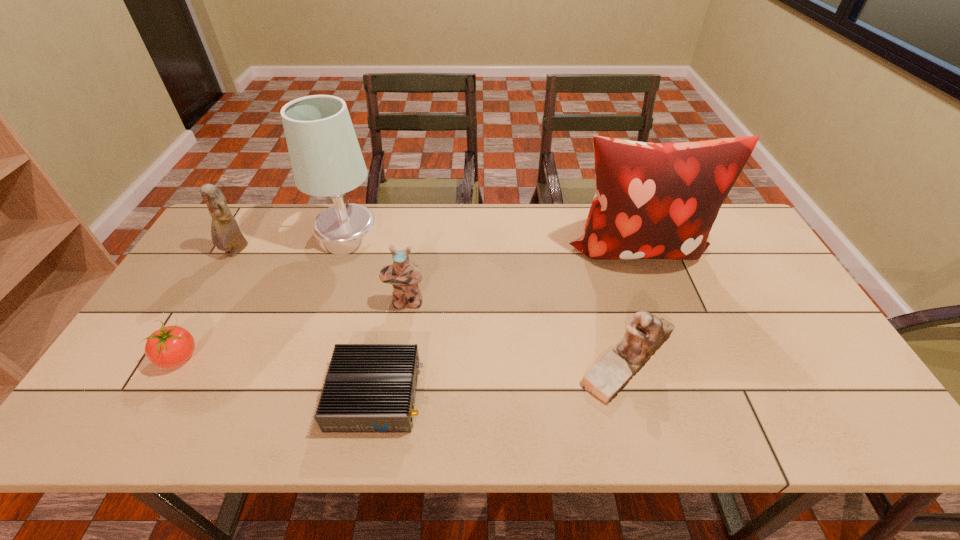
Where is `vacant space at the near edge of the desktop`? Image resolution: width=960 pixels, height=540 pixels. vacant space at the near edge of the desktop is located at coordinates (215, 409).

I want to click on vacant space at the left edge of the desktop, so click(x=126, y=361).

The image size is (960, 540). I want to click on blank space at the far left corner of the desktop, so click(x=263, y=221).

Image resolution: width=960 pixels, height=540 pixels. I want to click on free point at the far right corner, so click(725, 224).

Where is `free spot between the tomato and the lampshade`? free spot between the tomato and the lampshade is located at coordinates (263, 295).

Find the location of a particular element. free spot between the lampshade and the second figurine from left to right is located at coordinates tap(376, 268).

Find the location of a particular element. free space between the cushion and the farthest figurine is located at coordinates [437, 250].

Locate an element on the screen. The height and width of the screenshot is (540, 960). vacant space that is in between the lampshade and the second shortest object is located at coordinates (263, 295).

You are a GUI agent. You are given a task and a screenshot of the screen. Output one action in this format:
    pyautogui.click(x=<x>, y=<y>)
    Task: Click on the free point between the shortest figurine and the lampshade
    This screenshot has height=540, width=960.
    Given the screenshot: What is the action you would take?
    pyautogui.click(x=488, y=297)

You are a GUI agent. You are given a task and a screenshot of the screen. Output one action in this format:
    pyautogui.click(x=<x>, y=<y>)
    Task: Click on the vacant space that's between the fourth shortest object and the cushion
    Image resolution: width=960 pixels, height=540 pixels.
    Given the screenshot: What is the action you would take?
    [x=521, y=275]